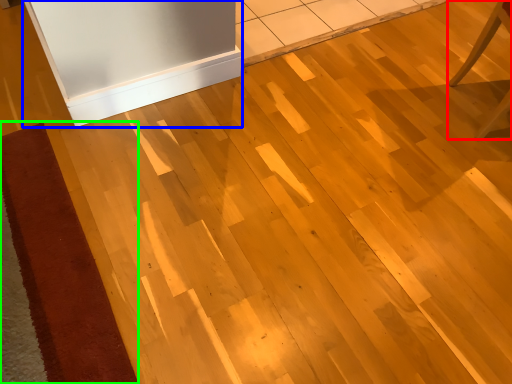
Question: Considering the real-world distances, which object is closest to furniture (highlighted by a red box)? fridge (highlighted by a blue box) or doormat (highlighted by a green box).

Choices:
 (A) fridge
 (B) doormat

Answer: (A)